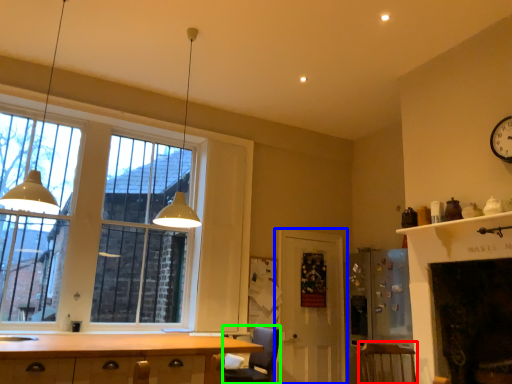
Question: Which is nearer to the armchair (highlighted by a red box)? door (highlighted by a blue box) or armchair (highlighted by a green box).

Choices:
 (A) door
 (B) armchair

Answer: (B)